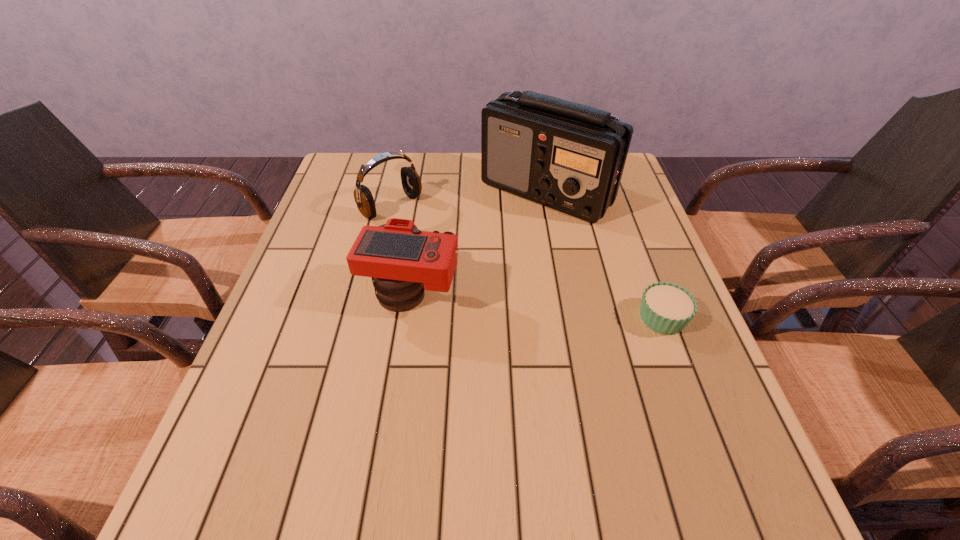
Find the location of a particular element. This screenshot has width=960, height=540. free spot between the cupcake and the radio receiver is located at coordinates (605, 255).

Identify the location of the third closest object relative to the tallest object. (666, 308).

Locate which object is the second closest to the tallest object. Please provide its 2D coordinates. Your answer should be formatted as a tuple, i.e. [(x, y)], where the tuple contains the x and y coordinates of a point satisfying the conditions above.

[(402, 261)]

Image resolution: width=960 pixels, height=540 pixels. Identify the location of vacant region that satisfies the following two spatial constraints: 1. on the back side of the tallest object; 2. on the left side of the camera. (427, 193).

Identify the location of vacant region that satisfies the following two spatial constraints: 1. on the front side of the cupcake; 2. on the left side of the radio receiver. click(x=570, y=318).